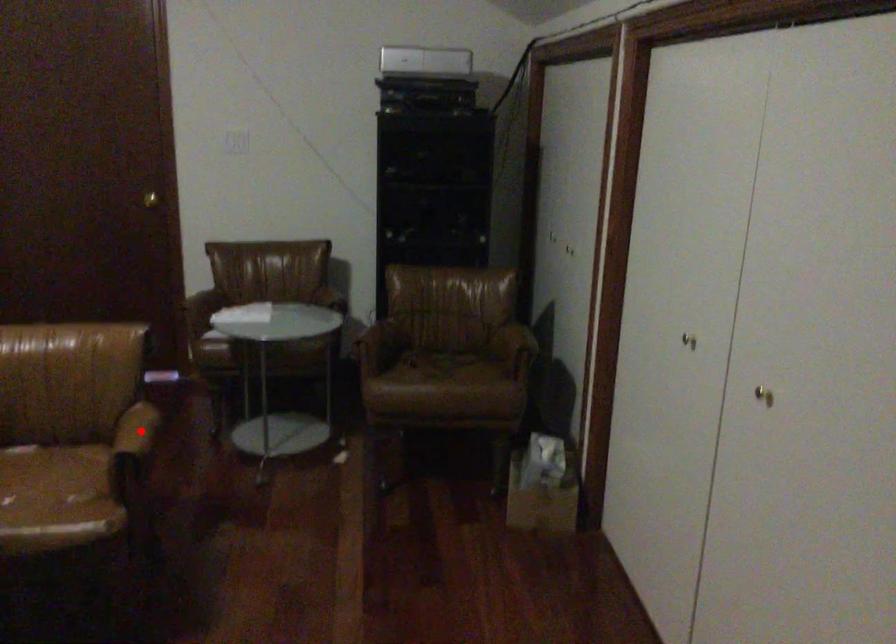
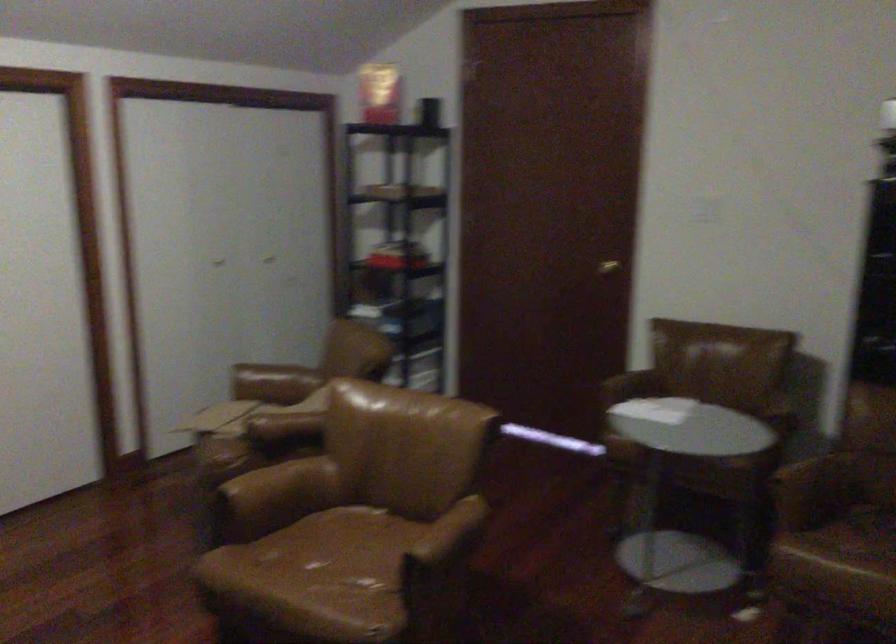
Find the pixel in the second image that matches the highlighted location in the first image.

(448, 536)